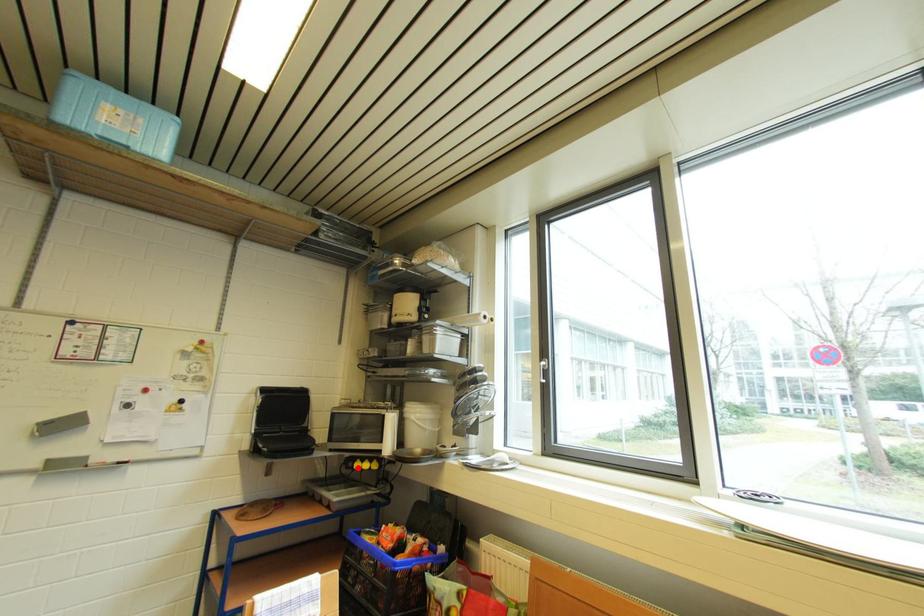
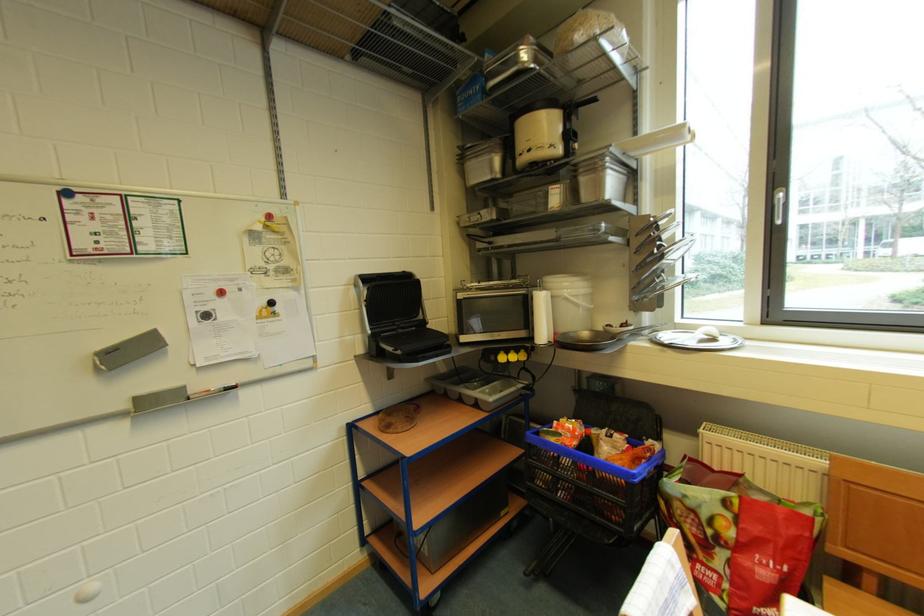
Where in the second image is the point corresponding to the highlighted location from the first image?

(500, 361)